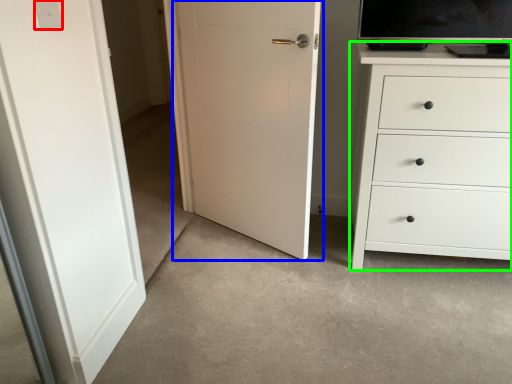
Question: Considering the real-world distances, which object is closest to light switch (highlighted by a red box)? door (highlighted by a blue box) or chest of drawers (highlighted by a green box).

Choices:
 (A) door
 (B) chest of drawers

Answer: (A)